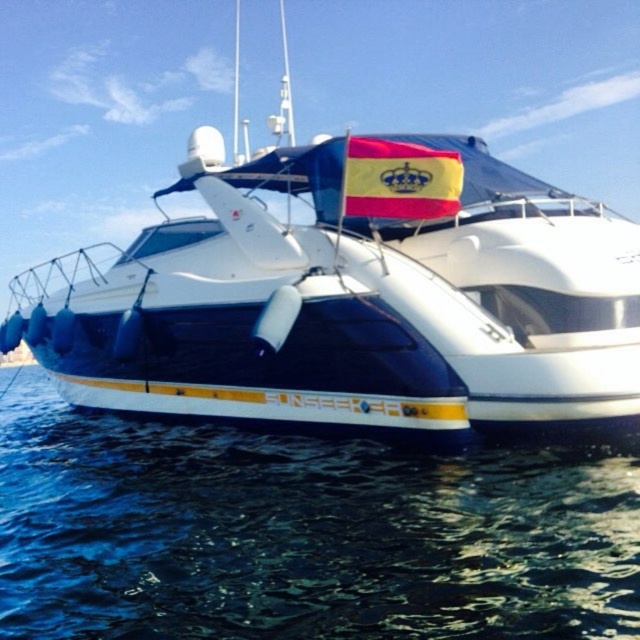
What do you see at coordinates (352, 305) in the screenshot?
I see `white glossy boat at center` at bounding box center [352, 305].

Who is more forward, (307, 307) or (358, 157)?

Point (358, 157)

Where is `white glossy boat at center`? Image resolution: width=640 pixels, height=640 pixels. white glossy boat at center is located at coordinates (352, 305).

Which is more to the left, white glossy boat at center or blue water at lower left?

white glossy boat at center

Is white glossy boat at center above blue water at lower left?

Correct, white glossy boat at center is located above blue water at lower left.

Locate an element on the screen. white glossy boat at center is located at coordinates (352, 305).

Image resolution: width=640 pixels, height=640 pixels. Identify the location of white glossy boat at center. [x=352, y=305].

Measure the distance between blue water at lower left and camera.

A distance of 9.77 feet exists between blue water at lower left and camera.

Who is more distant from viewer, (540,552) or (428,188)?

Point (428,188)

Does point (476, 529) lie in front of point (369, 156)?

Yes.

This screenshot has width=640, height=640. In order to click on blue water at lower left in this screenshot , I will do `click(301, 532)`.